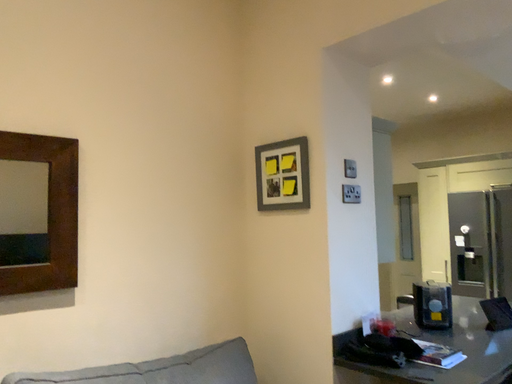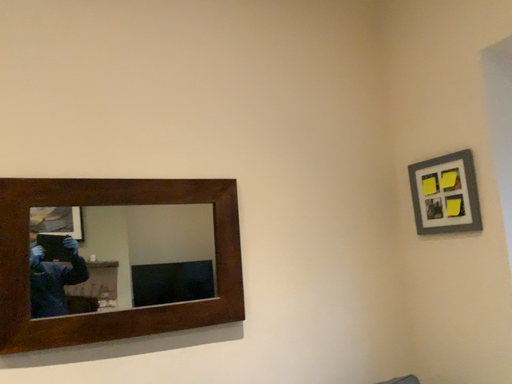
Question: How did the camera likely rotate when shooting the video?

Choices:
 (A) rotated left
 (B) rotated right

Answer: (A)